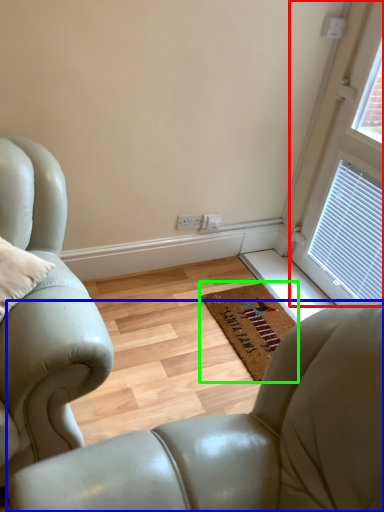
Question: Estimate the real-world distances between objects in this image. Which object is farther from window (highlighted by a red box), chair (highlighted by a blue box) or mat (highlighted by a green box)?

Choices:
 (A) chair
 (B) mat

Answer: (A)